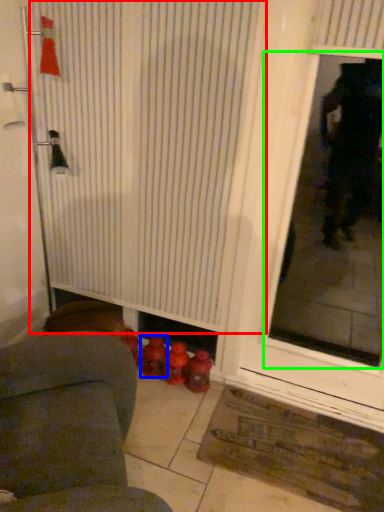
Question: Based on their relative distances, which object is farther from shower curtain (highlighted by a red box)? Choose from toy (highlighted by a blue box) and window screen (highlighted by a green box).

Choices:
 (A) toy
 (B) window screen

Answer: (B)